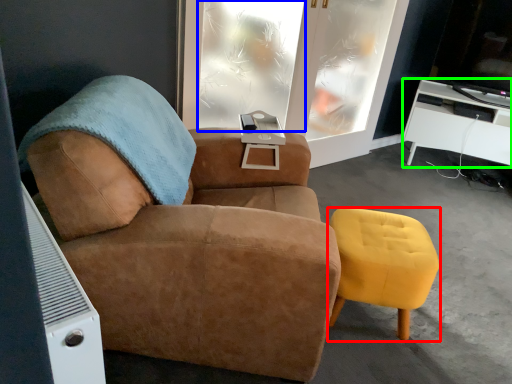
Question: Based on their relative distances, which object is nearer to stool (highlighted by a red box)? Choose from window (highlighted by a blue box) and desk (highlighted by a green box).

Choices:
 (A) window
 (B) desk

Answer: (A)